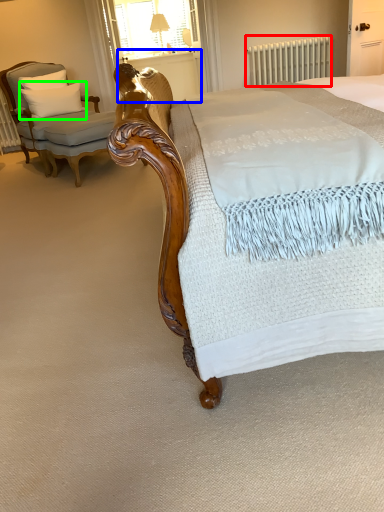
Question: Considering the real-world distances, which object is farthest from radiator (highlighted by a red box)? balustrade (highlighted by a blue box) or pillow (highlighted by a green box)?

Choices:
 (A) balustrade
 (B) pillow

Answer: (B)